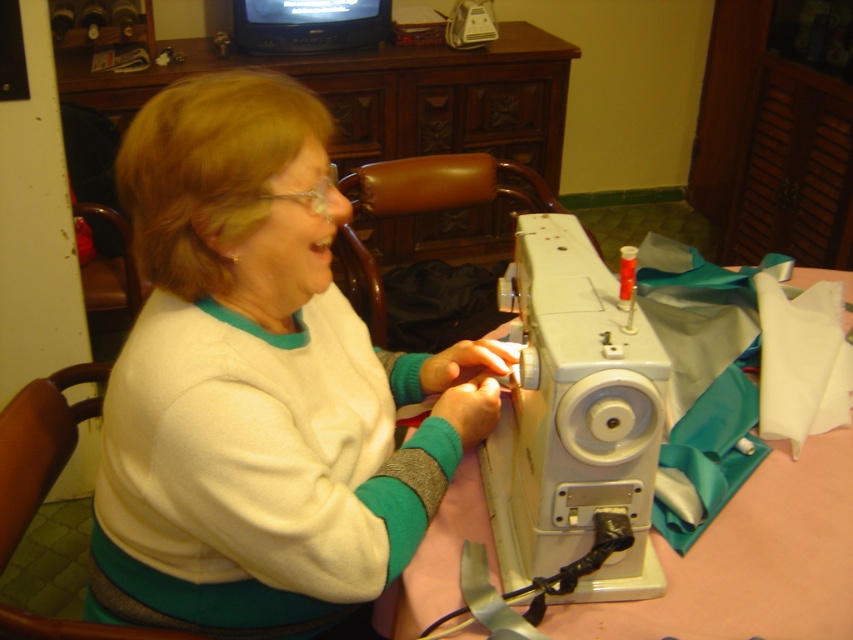
You are a tailor who needs to place a white fleece sweater at center onto a pink fabric at lower center. Based on the scene, can you determine the direction you should move the sweater to place it on the fabric?

The white fleece sweater at center is to the left of pink fabric at lower center, so you should move the sweater to the right to place it on the pink fabric at lower center.

You are a tailor trying to sew a new design. You have the white fleece sweater at center and the pink fabric at lower center in front of you. Which material should you grab first to ensure proper layering?

The white fleece sweater at center is in front of the pink fabric at lower center, so you should grab the pink fabric at lower center first to layer it underneath.